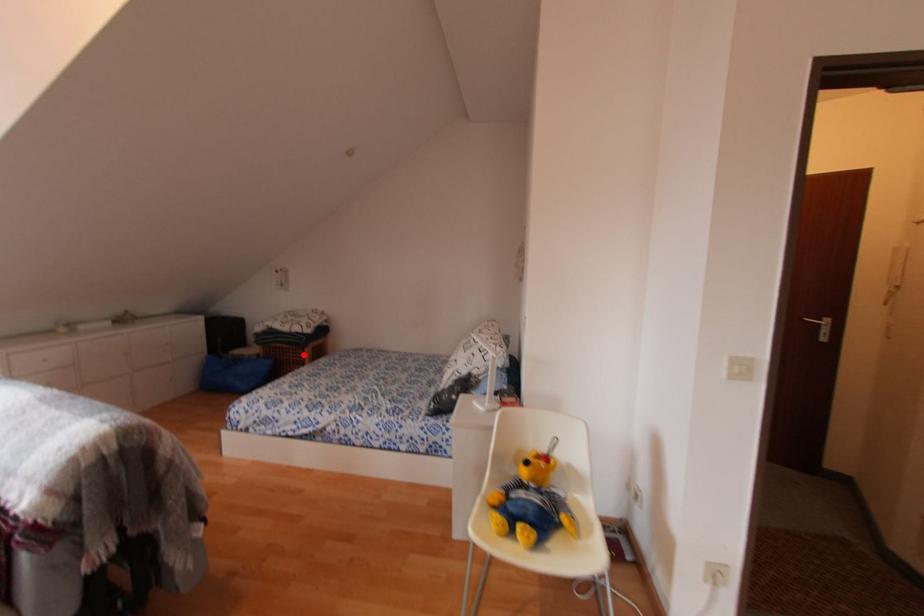
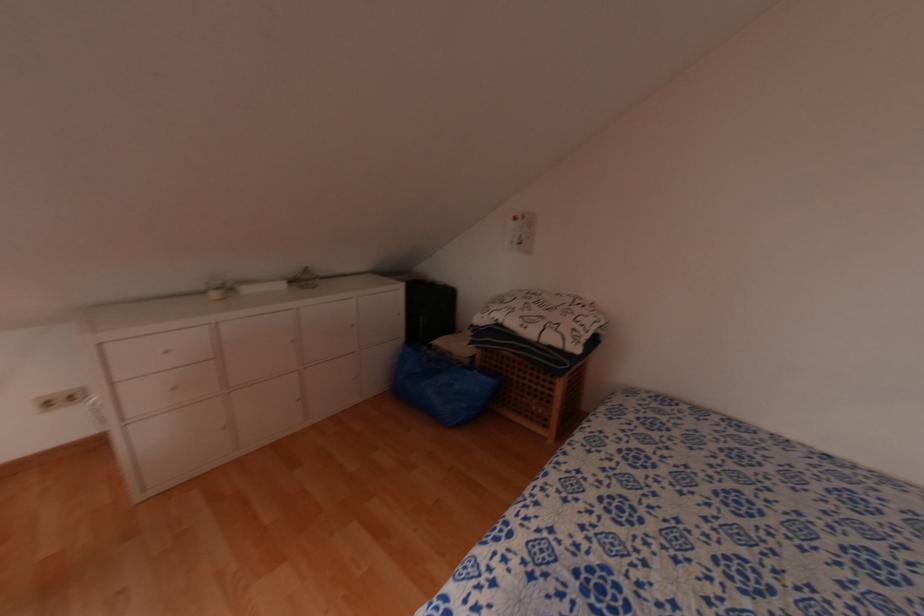
Locate, in the second image, the point that corresponds to the highlighted location in the first image.

(552, 384)